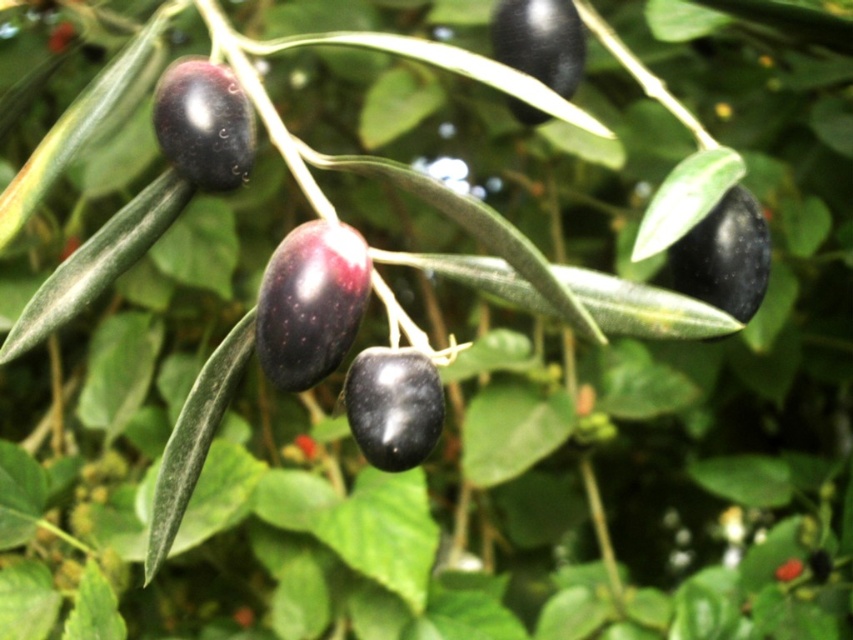
Question: In this image, where is shiny dark olive at upper left located relative to shiny black olive at upper center?

Choices:
 (A) right
 (B) left

Answer: (B)

Question: Which object is closer to the camera taking this photo?

Choices:
 (A) shiny black olive at center-right
 (B) shiny black olive at center
 (C) shiny black olive at upper center
 (D) shiny dark olive at center

Answer: (D)

Question: Can you confirm if shiny dark olive at upper left is positioned to the right of shiny black olive at center?

Choices:
 (A) no
 (B) yes

Answer: (A)

Question: Which of the following is the farthest from the observer?

Choices:
 (A) shiny black olive at upper center
 (B) shiny black olive at center
 (C) shiny black olive at center-right

Answer: (A)

Question: Which object is positioned closest to the shiny black olive at center-right?

Choices:
 (A) shiny black olive at center
 (B) shiny black olive at upper center

Answer: (B)

Question: Does shiny black olive at center-right have a smaller size compared to shiny black olive at upper center?

Choices:
 (A) no
 (B) yes

Answer: (A)